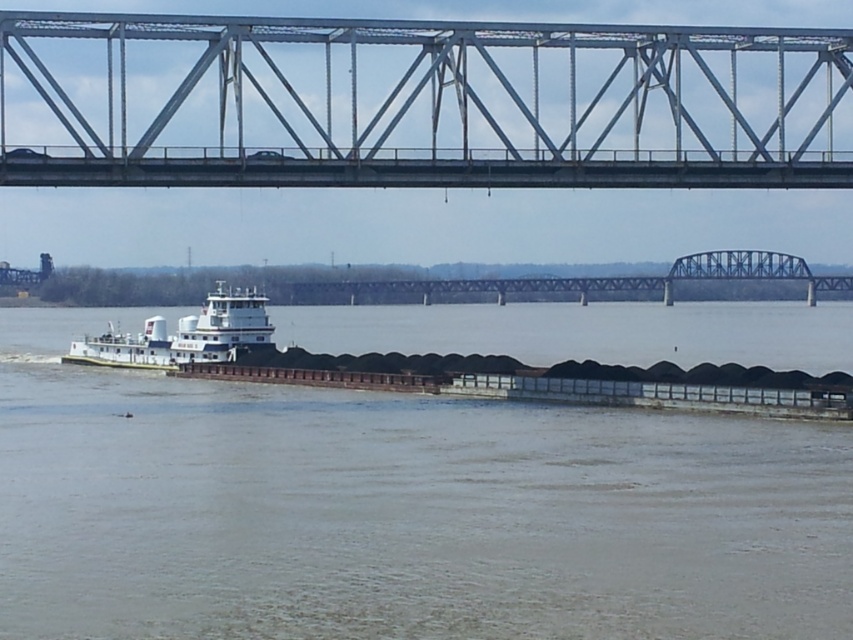
Question: Which of the following is the closest to the observer?

Choices:
 (A) metal bridge at upper center
 (B) white matte barge at lower left
 (C) brown matte barge at center

Answer: (C)

Question: Is metal bridge at upper center bigger than white matte barge at lower left?

Choices:
 (A) yes
 (B) no

Answer: (A)

Question: Is brown matte barge at center to the right of metal bridge at upper center from the viewer's perspective?

Choices:
 (A) yes
 (B) no

Answer: (A)

Question: Considering the real-world distances, which object is farthest from the metal bridge at upper center?

Choices:
 (A) brown matte barge at center
 (B) white matte barge at lower left

Answer: (B)

Question: Can you confirm if metal bridge at upper center is thinner than white matte barge at lower left?

Choices:
 (A) yes
 (B) no

Answer: (B)

Question: Which point is closer to the camera?

Choices:
 (A) tap(264, 330)
 (B) tap(277, 182)

Answer: (B)